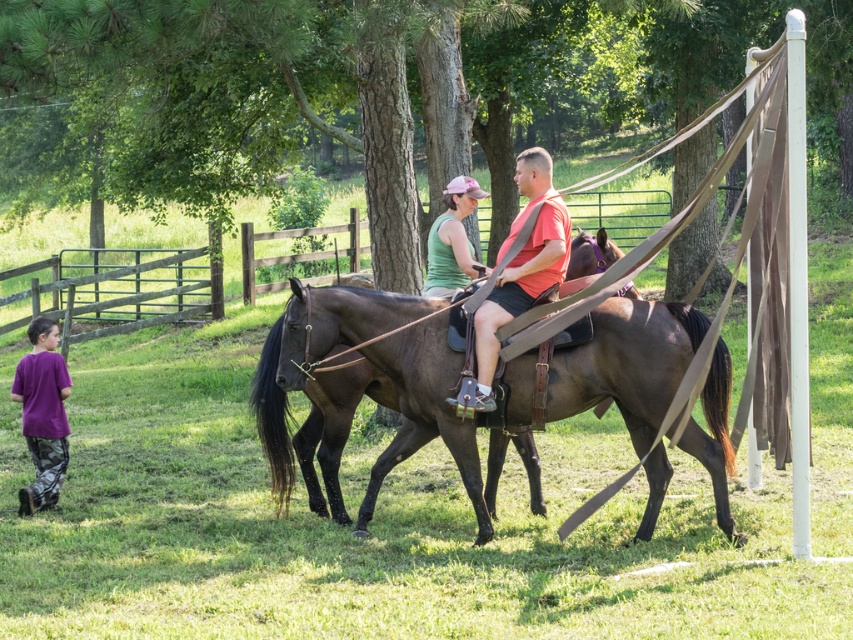
Question: Does shiny brown horse at center appear under matte brown leather saddle at center?

Choices:
 (A) yes
 (B) no

Answer: (A)

Question: Among these points, which one is nearest to the camera?

Choices:
 (A) (457, 250)
 (B) (32, 385)

Answer: (A)

Question: Does matte brown leather saddle at center appear under purple cotton shirt at lower left?

Choices:
 (A) no
 (B) yes

Answer: (A)

Question: Which point appears farthest from the camera in this image?

Choices:
 (A) (432, 396)
 (B) (440, 234)

Answer: (B)

Question: Can you confirm if shiny brown horse at center is bigger than matte green tank top at center?

Choices:
 (A) yes
 (B) no

Answer: (A)

Question: Which object is positioned farthest from the shiny brown horse at center?

Choices:
 (A) matte brown leather saddle at center
 (B) matte green tank top at center

Answer: (B)